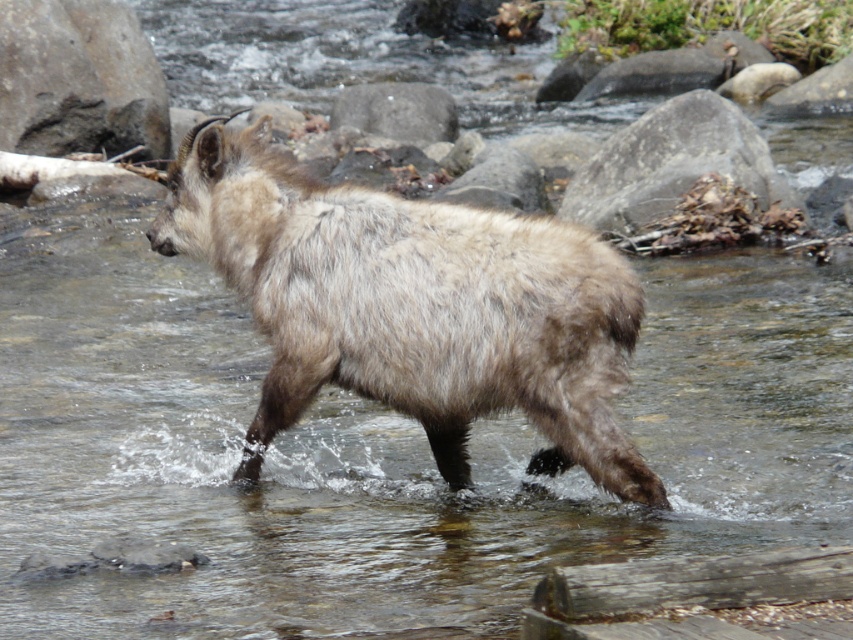
Which is more to the right, gray rock at upper left or gray rock at center?

Positioned to the right is gray rock at center.

Can you confirm if gray rock at upper left is positioned below gray rock at center?

No.

Describe the element at coordinates (78, 80) in the screenshot. I see `gray rock at upper left` at that location.

Identify the location of gray rock at upper left. The width and height of the screenshot is (853, 640). (78, 80).

Which of these two, fuzzy brown goat at center or gray rock at upper left, stands shorter?

fuzzy brown goat at center

From the picture: Who is more distant from viewer, (253, 444) or (41, 154)?

The point (41, 154) is more distant.

The width and height of the screenshot is (853, 640). What do you see at coordinates (412, 305) in the screenshot?
I see `fuzzy brown goat at center` at bounding box center [412, 305].

At what (x,y) coordinates should I click in order to perform the action: click on fuzzy brown goat at center. Please return your answer as a coordinate pair (x, y). Looking at the image, I should click on (412, 305).

Does gray rough rock at upper center have a greater width compared to gray rock at center?

Yes, gray rough rock at upper center is wider than gray rock at center.

Between point (683, 99) and point (375, 113), which one is positioned behind?

The point (375, 113) is more distant.

Find the location of a particular element. The width and height of the screenshot is (853, 640). gray rough rock at upper center is located at coordinates (671, 163).